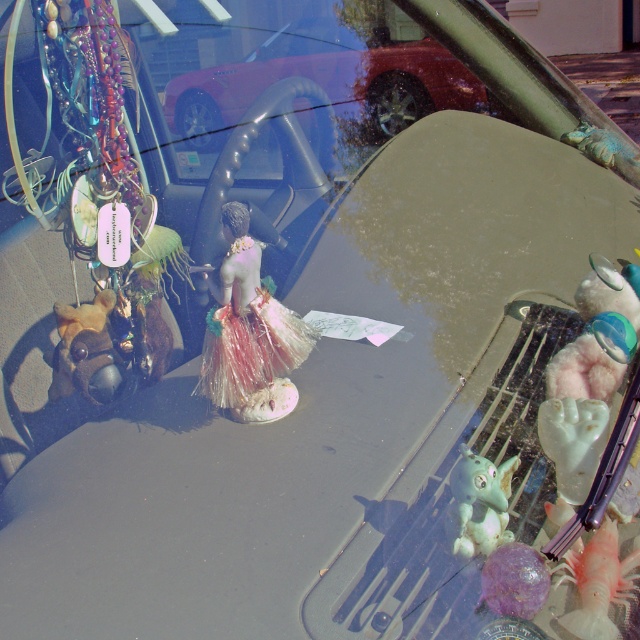
Question: Which point is closer to the camera taking this photo?

Choices:
 (A) (211, 93)
 (B) (285, 397)

Answer: (B)

Question: From the image, what is the correct spatial relationship of shiny metallic figurine at center in relation to green rubber toy at lower right?

Choices:
 (A) above
 (B) below

Answer: (A)

Question: Does shiny metallic figurine at center lie in front of green rubber toy at lower right?

Choices:
 (A) yes
 (B) no

Answer: (B)

Question: Can you confirm if shiny metallic figurine at center is positioned above green rubber toy at lower right?

Choices:
 (A) no
 (B) yes

Answer: (B)

Question: Which point is farther to the camera?

Choices:
 (A) (492, 524)
 (B) (198, 145)
 (C) (262, 339)

Answer: (B)

Question: Based on their relative distances, which object is nearer to the metallic red car at center?

Choices:
 (A) shiny metallic figurine at center
 (B) green rubber toy at lower right

Answer: (A)